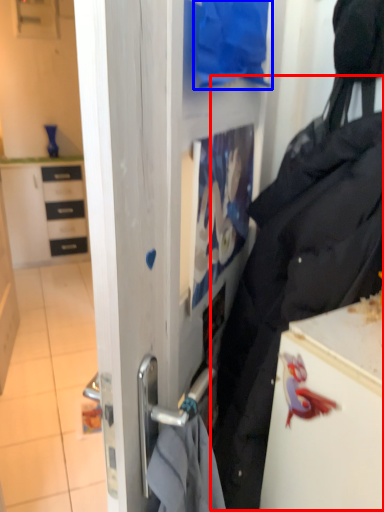
Question: Which object appears closest to the camera in this image, tote bag (highlighted by a red box) or clothing (highlighted by a blue box)?

Choices:
 (A) tote bag
 (B) clothing

Answer: (A)